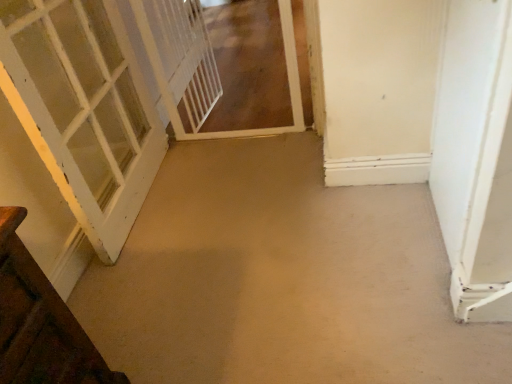
You are a GUI agent. You are given a task and a screenshot of the screen. Output one action in this format:
    pyautogui.click(x=<x>, y=<y>)
    Task: Click on the vacant location below white painted wood door at left, which is the third door in right-to-left order (from a real-world perspective)
    The width and height of the screenshot is (512, 384).
    Given the screenshot: What is the action you would take?
    pyautogui.click(x=141, y=203)